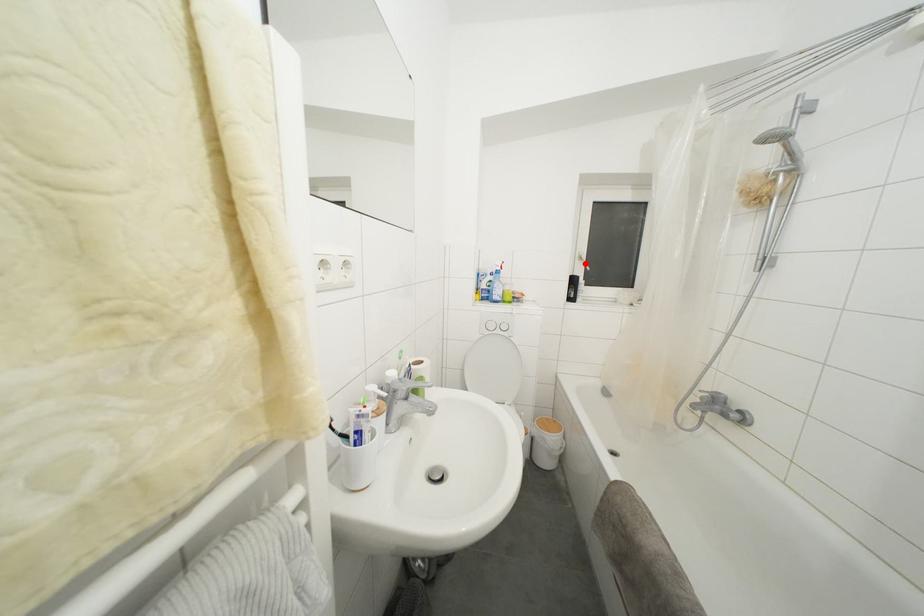
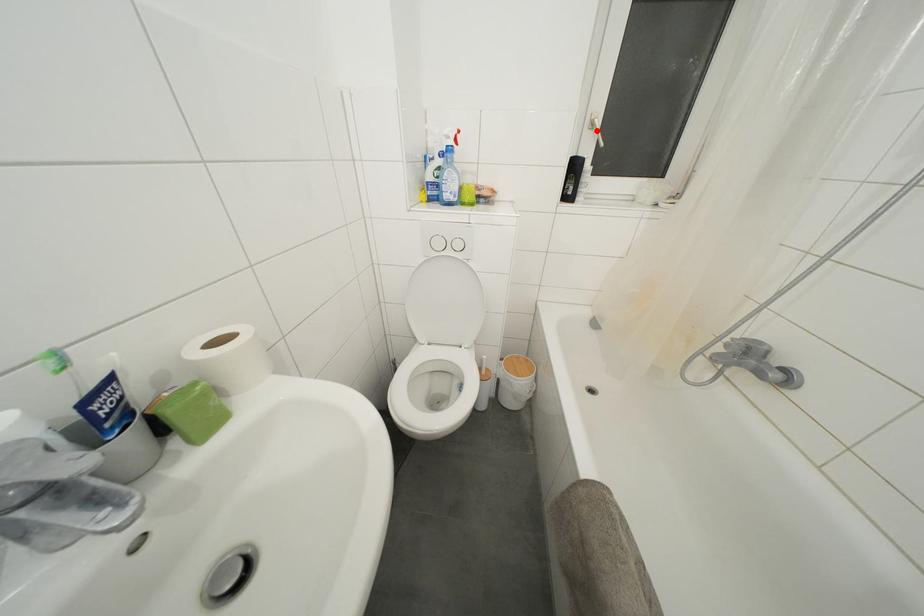
I am providing you with two images of the same scene from different viewpoints. A red point is marked on the first image and another point is marked on the second image. Do the highlighted points in image1 and image2 indicate the same real-world spot?

Yes